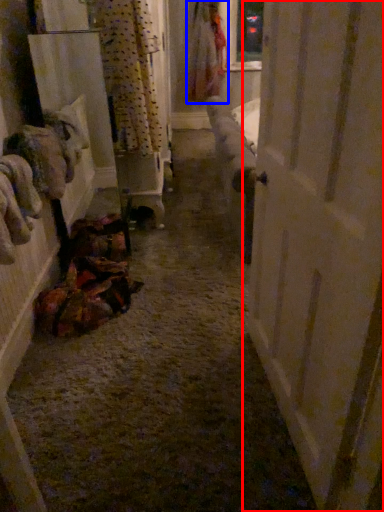
Question: Among these objects, which one is nearest to the camera, door (highlighted by a red box) or clothing (highlighted by a blue box)?

Choices:
 (A) door
 (B) clothing

Answer: (A)